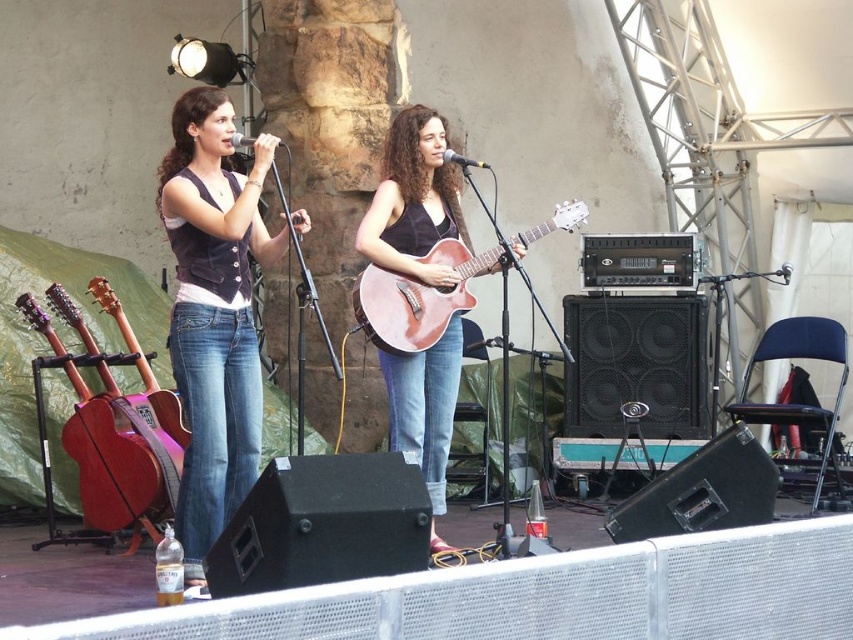
Does matte brown guitar at center have a greater height compared to matte brown acoustic guitar at left?

Yes.

Between matte brown guitar at center and matte brown acoustic guitar at left, which one is positioned lower?

matte brown acoustic guitar at left

Who is more forward, (x=410, y=189) or (x=77, y=412)?

Point (x=410, y=189) is in front.

Where is `matte brown guitar at center`? The image size is (853, 640). matte brown guitar at center is located at coordinates (413, 200).

Between denim jeans at center and matte brown guitar at center, which one is positioned lower?

denim jeans at center is below.

Consider the image. Can you confirm if denim jeans at center is positioned to the left of matte brown guitar at center?

Indeed, denim jeans at center is positioned on the left side of matte brown guitar at center.

This screenshot has width=853, height=640. Describe the element at coordinates (213, 312) in the screenshot. I see `denim jeans at center` at that location.

The image size is (853, 640). What are the coordinates of `denim jeans at center` in the screenshot? It's located at (213, 312).

Does point (236, 385) come closer to viewer compared to point (538, 230)?

Yes, it is.

Is point (210, 518) closer to viewer compared to point (552, 220)?

That is True.

Locate an element on the screen. denim jeans at center is located at coordinates (213, 312).